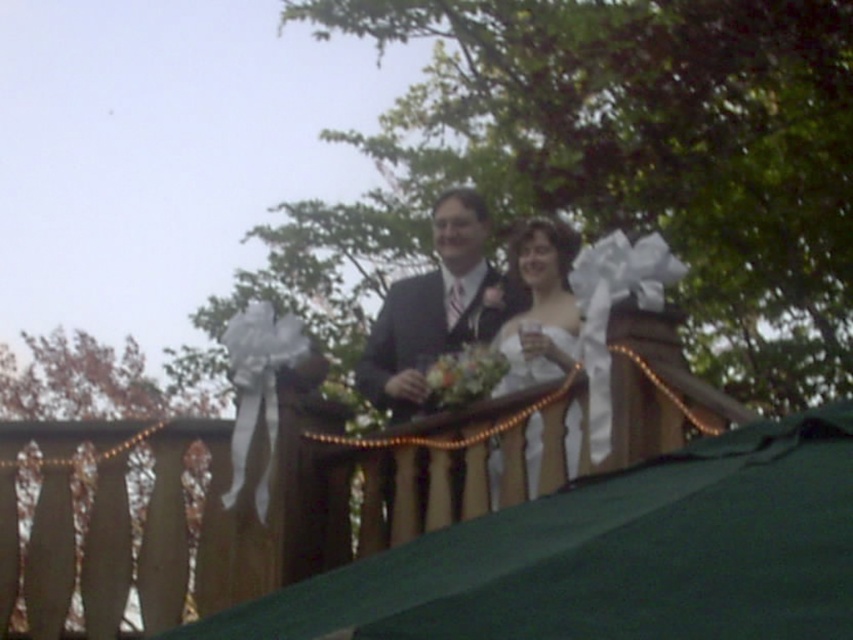
Does green fabric canopy at upper center have a greater width compared to dark gray suit at center?

Yes, green fabric canopy at upper center is wider than dark gray suit at center.

Who is more distant from viewer, [577,488] or [459,260]?

Point [459,260]

What do you see at coordinates (614, 556) in the screenshot? The width and height of the screenshot is (853, 640). I see `green fabric canopy at upper center` at bounding box center [614, 556].

The height and width of the screenshot is (640, 853). In order to click on green fabric canopy at upper center in this screenshot , I will do `click(614, 556)`.

Measure the distance between point (366, 380) and camera.

Point (366, 380) is 6.77 meters from camera.

Which is below, dark gray suit at center or white satin dress at center?

white satin dress at center is lower down.

Is point (517, 289) farther from viewer compared to point (534, 477)?

That is True.

This screenshot has height=640, width=853. In order to click on dark gray suit at center in this screenshot , I will do `click(436, 308)`.

You are a GUI agent. You are given a task and a screenshot of the screen. Output one action in this format:
    pyautogui.click(x=<x>, y=<y>)
    Task: Click on the green fabric canopy at upper center
    Image resolution: width=853 pixels, height=640 pixels.
    Given the screenshot: What is the action you would take?
    pyautogui.click(x=614, y=556)